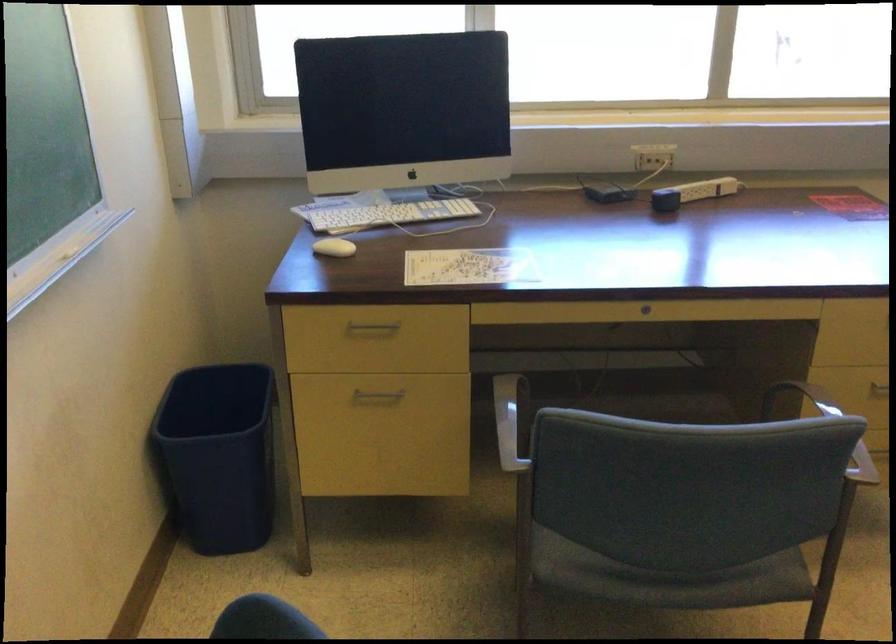
Where is `chair sitting surface`? chair sitting surface is located at coordinates click(x=668, y=578).